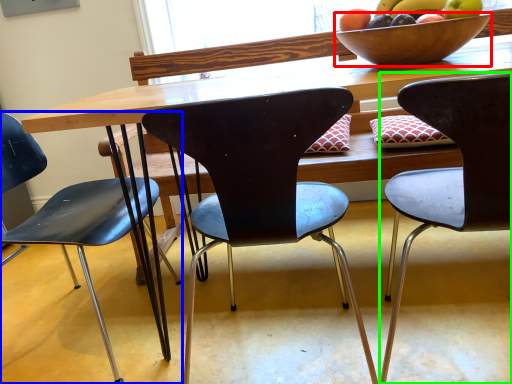
Question: Based on their relative distances, which object is farther from bowl (highlighted by a red box)? Choose from chair (highlighted by a blue box) and chair (highlighted by a green box).

Choices:
 (A) chair
 (B) chair

Answer: (A)